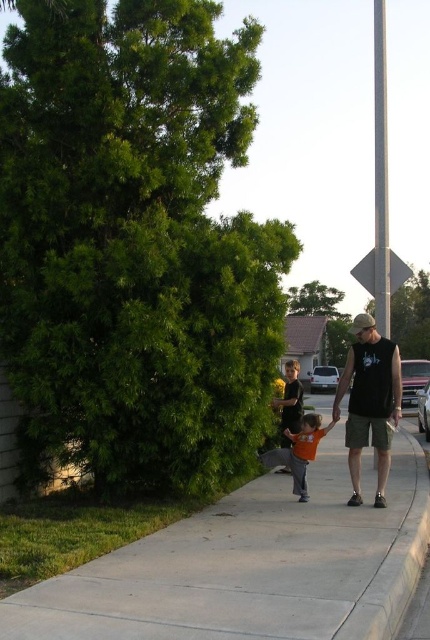
The width and height of the screenshot is (430, 640). I want to click on black sleeveless shirt at center, so click(369, 401).

Measure the distance between black sleeveless shirt at center and orange cotton shirt at center.

black sleeveless shirt at center and orange cotton shirt at center are 33.16 inches apart.

Between point (365, 406) and point (288, 449), which one is positioned in front?

Point (365, 406)

Where is `black sleeveless shirt at center`? The height and width of the screenshot is (640, 430). black sleeveless shirt at center is located at coordinates (369, 401).

Locate an element on the screen. concrete sidewalk at center is located at coordinates (254, 564).

Is concrete sidewalk at center further to camera compared to black matte diamond at upper right?

No, concrete sidewalk at center is closer to the viewer.

Describe the element at coordinates (254, 564) in the screenshot. I see `concrete sidewalk at center` at that location.

The image size is (430, 640). What are the coordinates of `concrete sidewalk at center` in the screenshot? It's located at (254, 564).

Is concrete sidewalk at center to the left of orange cotton shirt at center from the viewer's perspective?

No, concrete sidewalk at center is not to the left of orange cotton shirt at center.

Which is behind, point (187, 545) or point (263, 461)?

The point (263, 461) is behind.

The image size is (430, 640). I want to click on concrete sidewalk at center, so click(x=254, y=564).